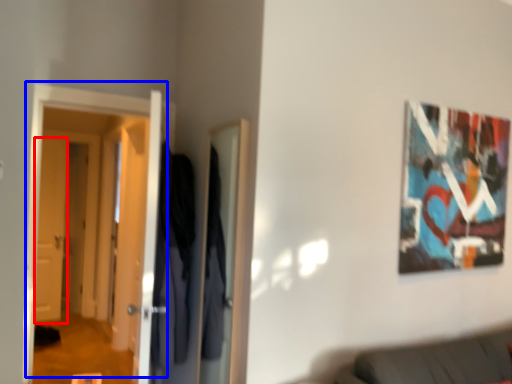
Question: Which object appears closest to the camera in this image, door (highlighted by a red box) or door (highlighted by a blue box)?

Choices:
 (A) door
 (B) door

Answer: (B)